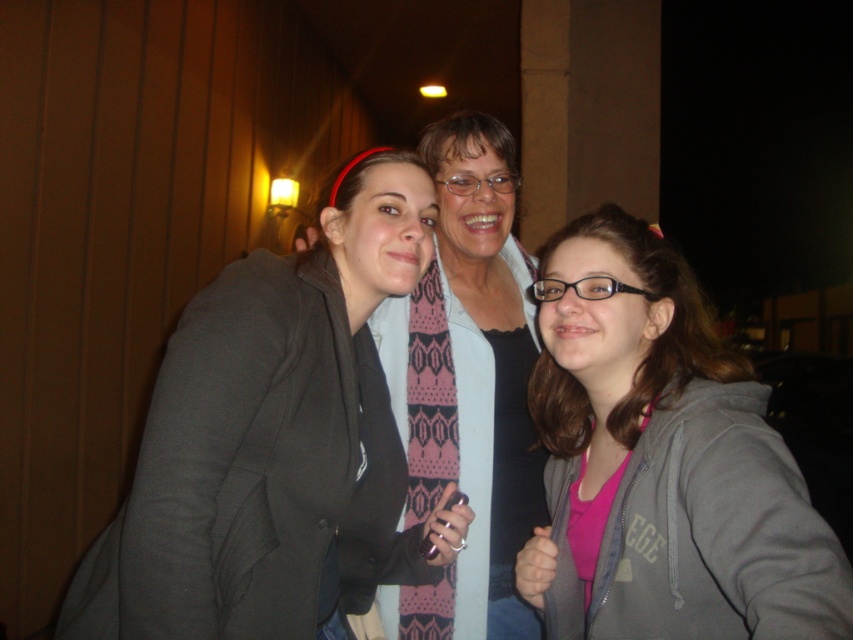
Question: Which object appears farthest from the camera in this image?

Choices:
 (A) matte gray hoodie at center
 (B) pink matte hoodie at center

Answer: (A)

Question: Which point is farther to the camera?

Choices:
 (A) (165, 552)
 (B) (762, 422)

Answer: (B)

Question: Does matte gray hoodie at center have a smaller size compared to pink matte hoodie at center?

Choices:
 (A) yes
 (B) no

Answer: (B)

Question: Is matte gray hoodie at center smaller than pink matte hoodie at center?

Choices:
 (A) no
 (B) yes

Answer: (A)

Question: Considering the relative positions of matte gray hoodie at center and pink matte hoodie at center in the image provided, where is matte gray hoodie at center located with respect to pink matte hoodie at center?

Choices:
 (A) left
 (B) right

Answer: (A)